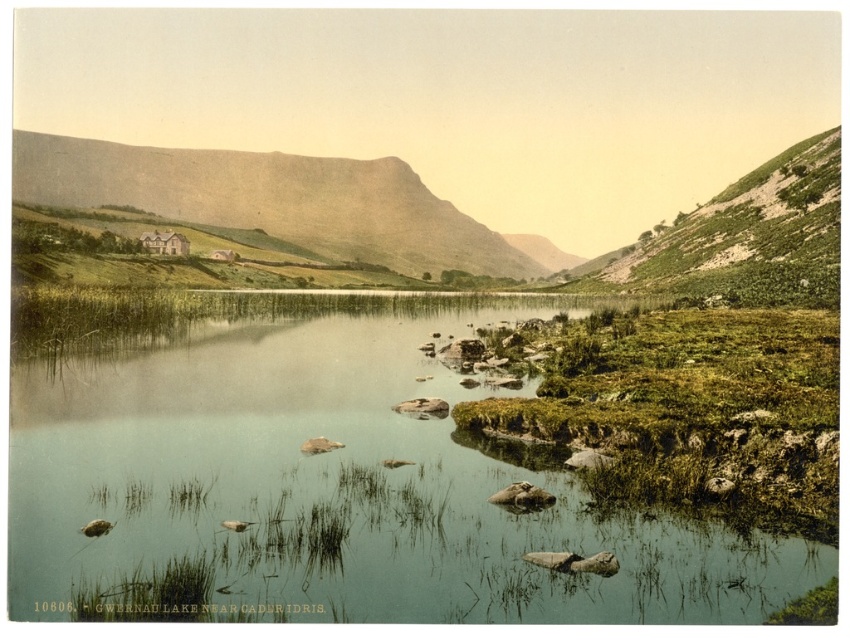
Which of these two, green grassy river at center or smooth beige mountain at center, stands shorter?

green grassy river at center

Does green grassy river at center appear on the left side of smooth beige mountain at center?

Incorrect, green grassy river at center is not on the left side of smooth beige mountain at center.

At what (x,y) coordinates should I click in order to perform the action: click on green grassy river at center. Please return your answer as a coordinate pair (x, y). Image resolution: width=850 pixels, height=640 pixels. Looking at the image, I should click on (332, 483).